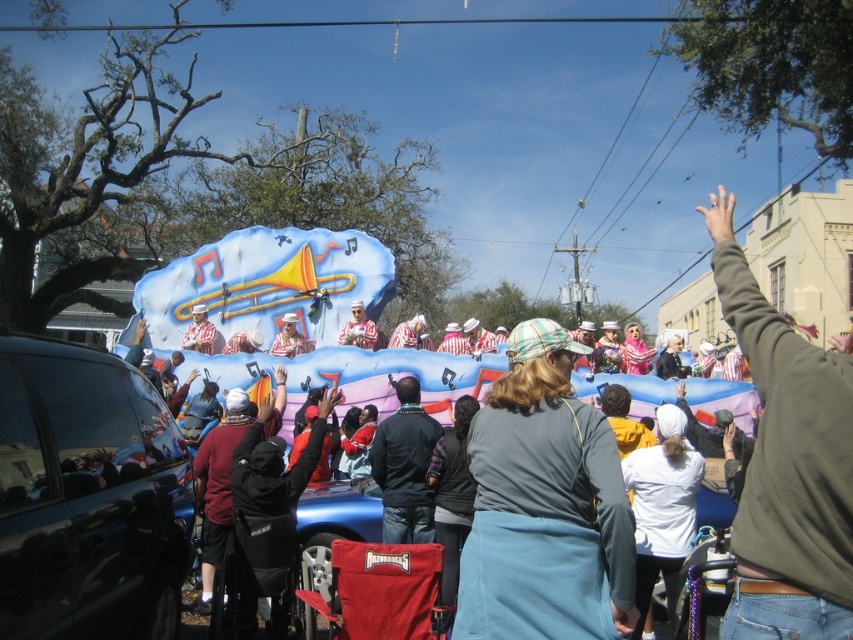
You are a photographer trying to capture a clear photo of the white matte jacket at center without the gray fabric hat at center blocking it. How can you adjust your position to achieve this?

Since the gray fabric hat at center is taller than the white matte jacket at center, you can lower your camera angle to position it below the hat, allowing the jacket to be visible without obstruction.

You are a photographer trying to capture the float in the background. You notice the green matte shirt at upper right and the dark blue jacket at center are blocking your view. Which clothing item is bigger and might be obstructing your view more?

The green matte shirt at upper right is larger in size than the dark blue jacket at center, so it is more likely obstructing your view.